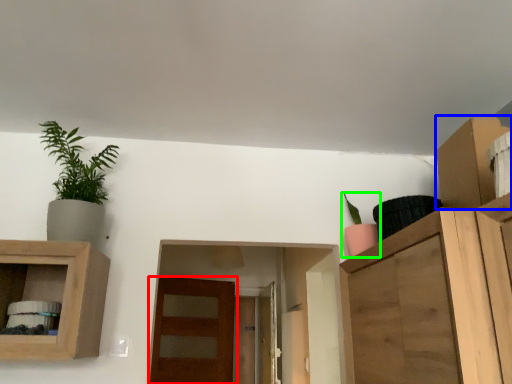
Question: Considering the real-world distances, which object is farthest from door (highlighted by a red box)? cabinet (highlighted by a blue box) or houseplant (highlighted by a green box)?

Choices:
 (A) cabinet
 (B) houseplant

Answer: (A)